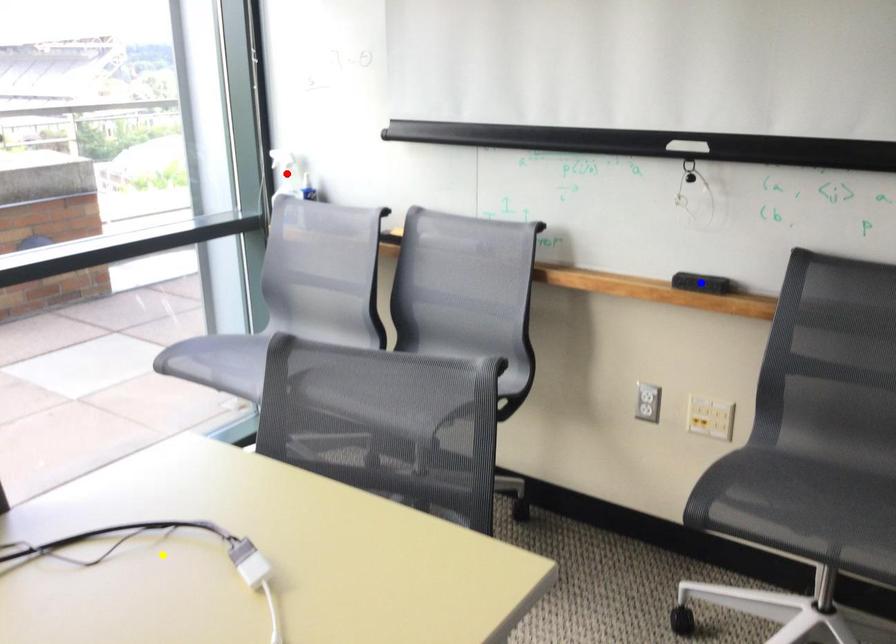
Order these from nearest to farthest:
yellow point
blue point
red point

yellow point, blue point, red point